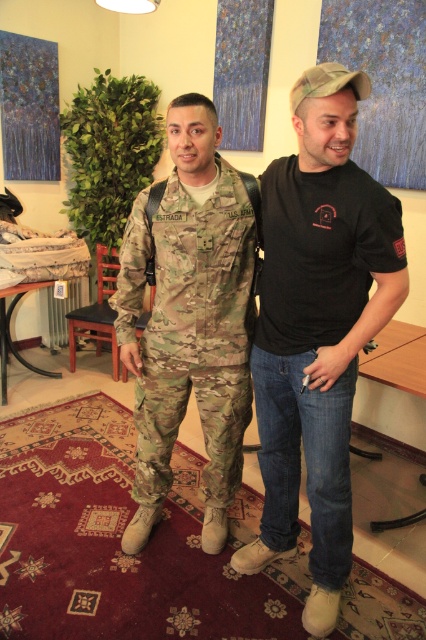
Question: Can you confirm if black matte t-shirt at center is smaller than camouflage fabric uniform at center?

Choices:
 (A) no
 (B) yes

Answer: (A)

Question: Which point is closer to the camera taking this photo?

Choices:
 (A) (233, 486)
 (B) (324, 452)

Answer: (B)

Question: Considering the relative positions of black matte t-shirt at center and camouflage fabric uniform at center in the image provided, where is black matte t-shirt at center located with respect to camouflage fabric uniform at center?

Choices:
 (A) left
 (B) right

Answer: (B)

Question: Is black matte t-shirt at center smaller than camouflage fabric uniform at center?

Choices:
 (A) no
 (B) yes

Answer: (A)

Question: Which point is farther to the camera?

Choices:
 (A) (279, 422)
 (B) (204, 365)

Answer: (B)